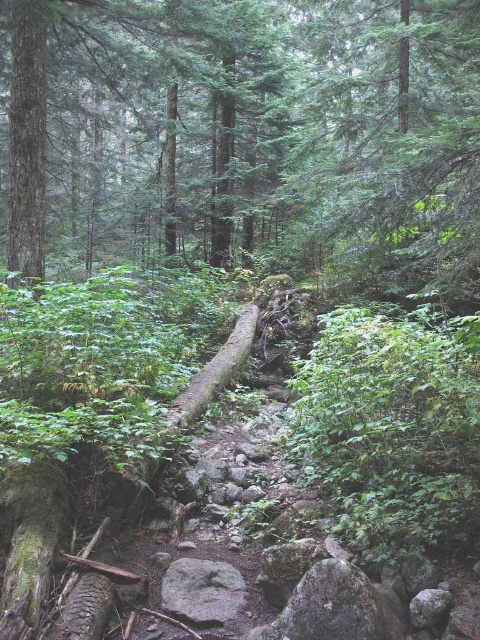
Question: Does smooth brown log at left have a smaller size compared to gray rough rock at center?

Choices:
 (A) yes
 (B) no

Answer: (B)

Question: Considering the real-world distances, which object is farthest from the smooth brown log at left?

Choices:
 (A) gray rough rock at center
 (B) gray rough rock at lower center

Answer: (B)

Question: Among these points, which one is nearest to the camera?

Choices:
 (A) (313, 13)
 (B) (284, 624)
 (C) (10, 173)
 (D) (204, 620)

Answer: (B)

Question: From the image, what is the correct spatial relationship of gray rough rock at lower center in relation to gray rough rock at center?

Choices:
 (A) below
 (B) above

Answer: (B)

Question: Which is farther from the smooth brown log at left?

Choices:
 (A) gray rough rock at lower center
 (B) gray rough rock at center

Answer: (A)

Question: Is smooth brown log at left wider than gray rough rock at lower center?

Choices:
 (A) no
 (B) yes

Answer: (B)